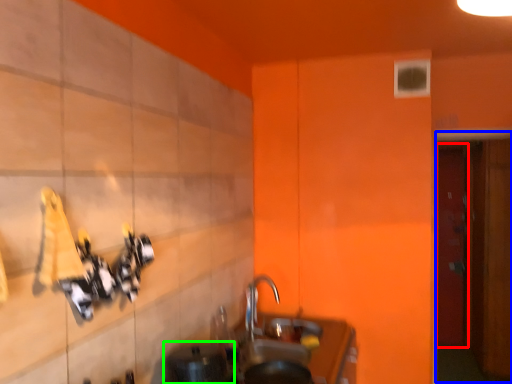
Question: Considering the real-world distances, which object is closest to door (highlighted by a red box)? door (highlighted by a blue box) or appliance (highlighted by a green box).

Choices:
 (A) door
 (B) appliance

Answer: (A)